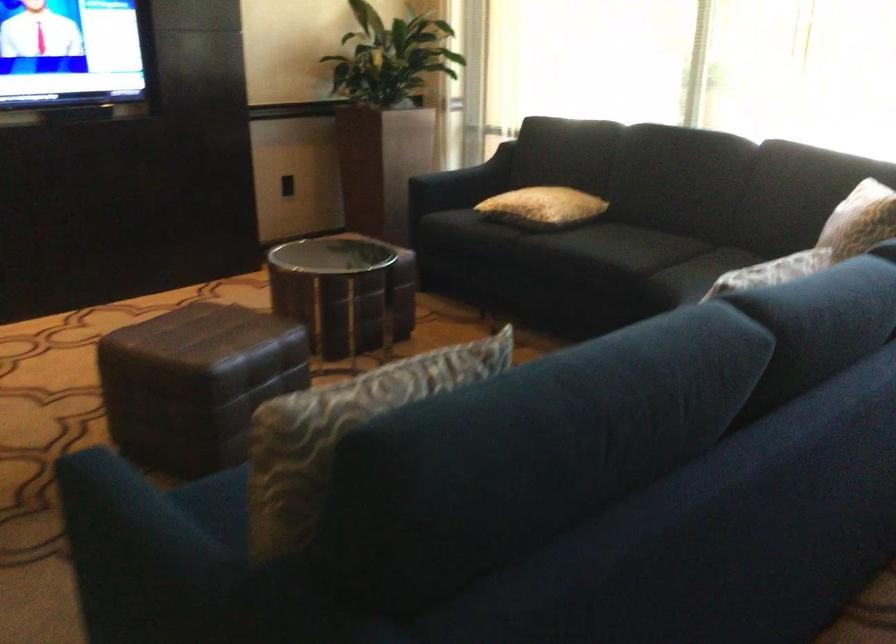
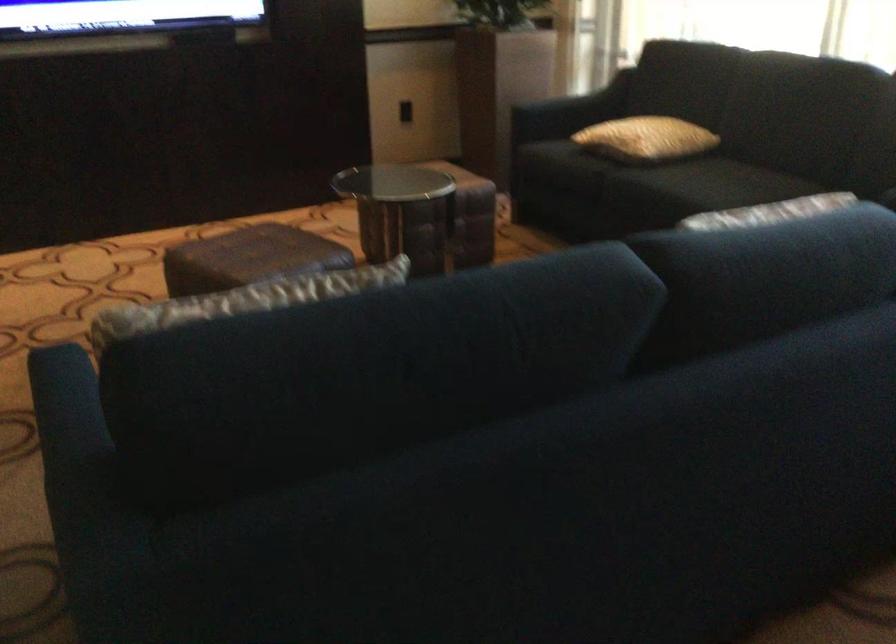
Question: Based on the continuous images, in which direction is the camera rotating? Reply with the corresponding letter.

Choices:
 (A) Left
 (B) Right
 (C) Up
 (D) Down

Answer: (A)